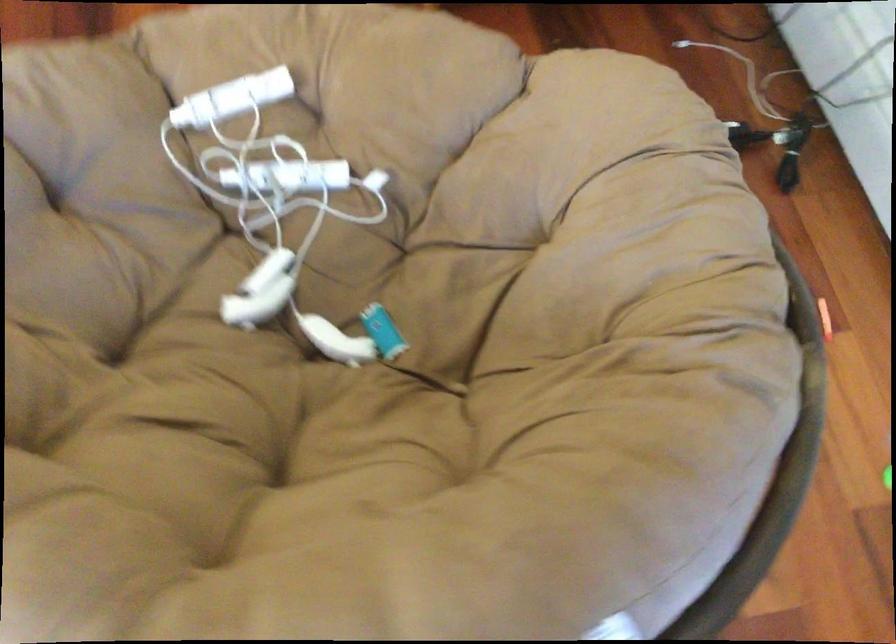
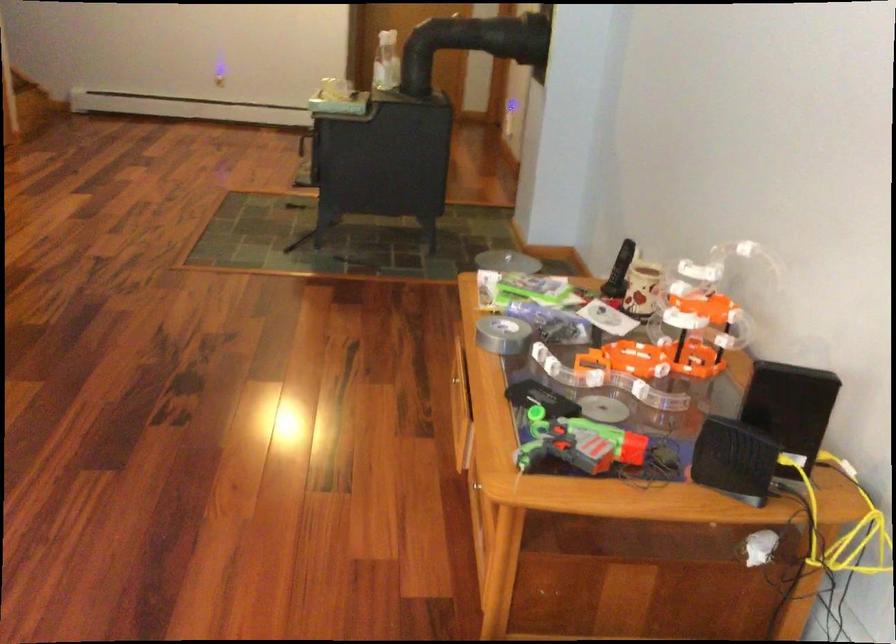
Question: Based on the continuous images, in which direction is the camera rotating? Reply with the corresponding letter.

Choices:
 (A) Left
 (B) Right
 (C) Up
 (D) Down

Answer: (C)